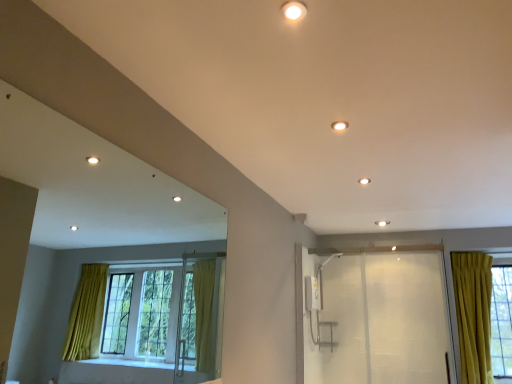
Question: Based on their positions, is transparent plastic screen door at right located to the left or right of matte white light fixture at upper center, which appears as the 1th lighting when ordered from the bottom?

Choices:
 (A) right
 (B) left

Answer: (A)

Question: Is transparent plastic screen door at right bigger or smaller than matte white light fixture at upper center, which is the first lighting from back to front?

Choices:
 (A) big
 (B) small

Answer: (A)

Question: Considering the real-world distances, which object is farthest from the matte white light fixture at upper center, placed as the second lighting when sorted from back to front?

Choices:
 (A) transparent plastic screen door at right
 (B) matte white light fixture at upper center, which is counted as the 2th lighting, starting from the front

Answer: (A)

Question: Which of these objects is positioned closest to the matte white light fixture at upper center, the 2th lighting when ordered from bottom to top?

Choices:
 (A) matte white light fixture at upper center, the first lighting from the right
 (B) transparent plastic screen door at right

Answer: (A)